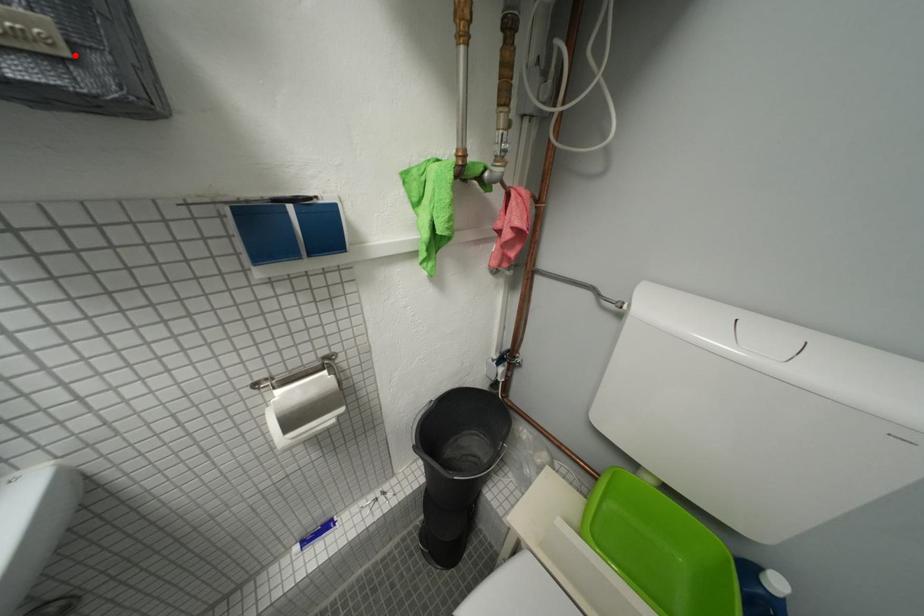
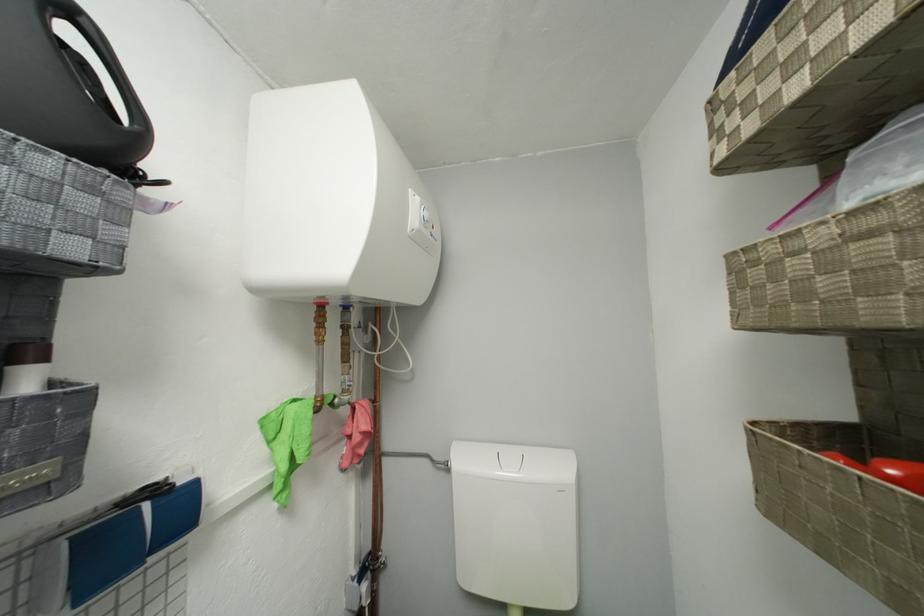
Question: I am providing you with two images of the same scene from different viewpoints. A red point is marked on the first image. At the location where the point appears in image 1, is it still visible in image 2?

Choices:
 (A) Yes
 (B) No

Answer: (A)